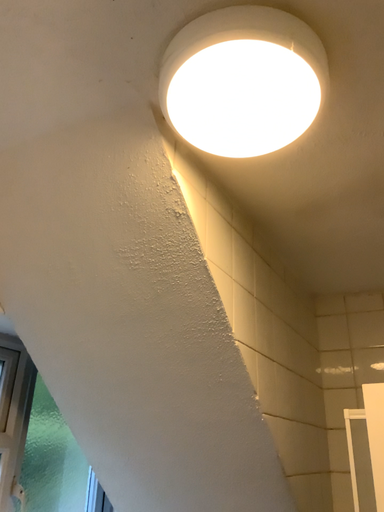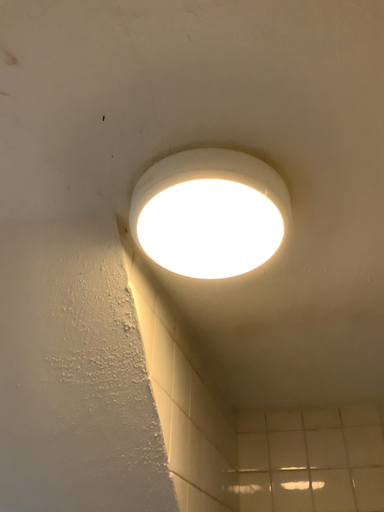
Question: How did the camera likely rotate when shooting the video?

Choices:
 (A) rotated left
 (B) rotated right

Answer: (B)